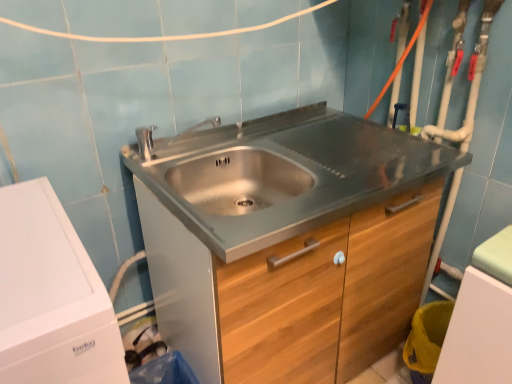
Question: Is white matte washing machine at left located outside stainless steel cabinet at center?

Choices:
 (A) no
 (B) yes

Answer: (B)

Question: From a real-world perspective, is white matte washing machine at left located beneath stainless steel cabinet at center?

Choices:
 (A) no
 (B) yes

Answer: (A)

Question: Is white matte washing machine at left at the right side of stainless steel cabinet at center?

Choices:
 (A) yes
 (B) no

Answer: (B)

Question: Does white matte washing machine at left have a larger size compared to stainless steel cabinet at center?

Choices:
 (A) yes
 (B) no

Answer: (B)

Question: Is white matte washing machine at left further to camera compared to stainless steel cabinet at center?

Choices:
 (A) yes
 (B) no

Answer: (B)

Question: Can you confirm if white matte washing machine at left is positioned to the left of stainless steel cabinet at center?

Choices:
 (A) no
 (B) yes

Answer: (B)

Question: Could white matte washing machine at left be considered to be inside stainless steel cabinet at center?

Choices:
 (A) no
 (B) yes

Answer: (A)

Question: Is stainless steel cabinet at center positioned far away from white matte washing machine at left?

Choices:
 (A) no
 (B) yes

Answer: (A)

Question: Can you confirm if stainless steel cabinet at center is bigger than white matte washing machine at left?

Choices:
 (A) yes
 (B) no

Answer: (A)

Question: Does stainless steel cabinet at center have a lesser height compared to white matte washing machine at left?

Choices:
 (A) no
 (B) yes

Answer: (B)

Question: Considering the relative positions of stainless steel cabinet at center and white matte washing machine at left in the image provided, is stainless steel cabinet at center behind white matte washing machine at left?

Choices:
 (A) yes
 (B) no

Answer: (A)

Question: Can you confirm if stainless steel cabinet at center is smaller than white matte washing machine at left?

Choices:
 (A) no
 (B) yes

Answer: (A)

Question: Considering the positions of white matte washing machine at left and stainless steel cabinet at center in the image, is white matte washing machine at left bigger or smaller than stainless steel cabinet at center?

Choices:
 (A) small
 (B) big

Answer: (A)